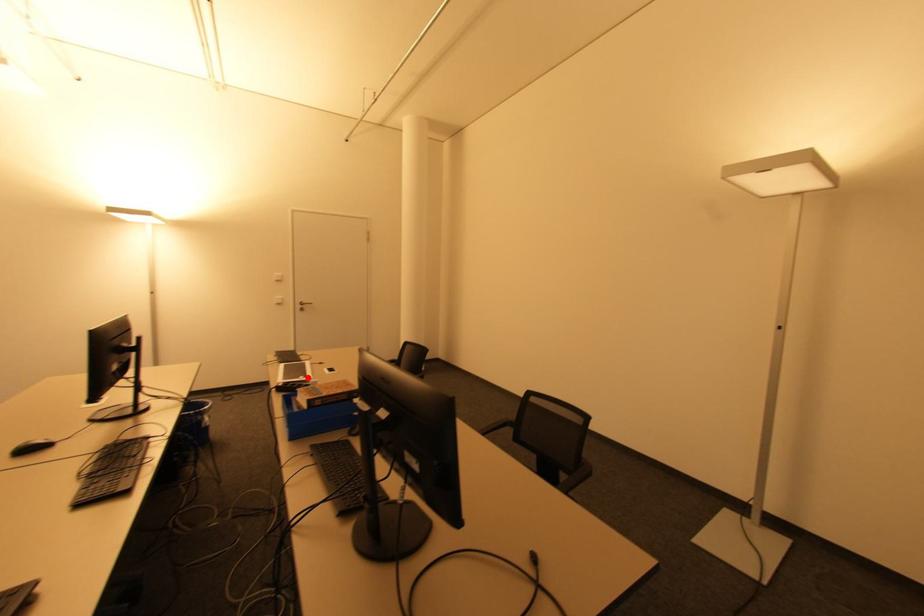
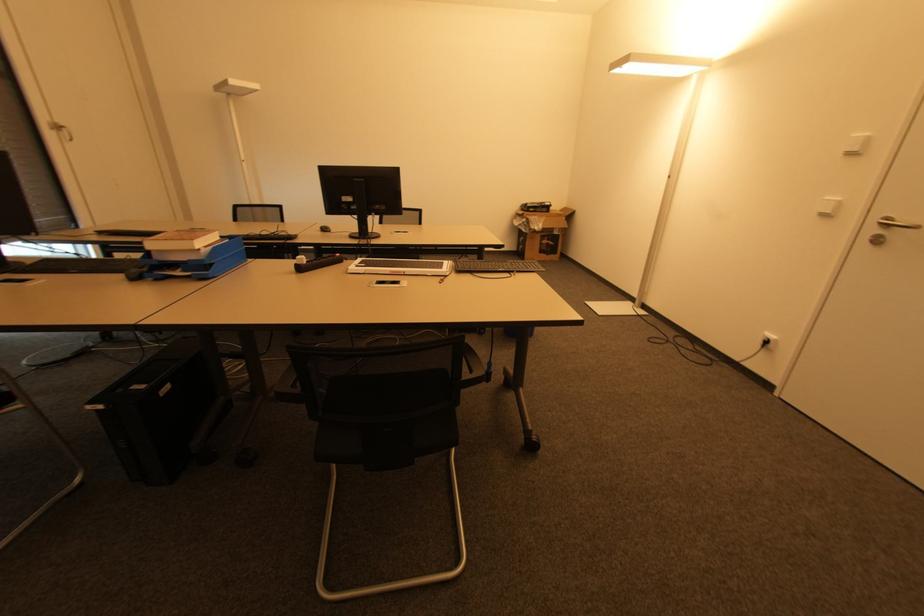
Locate, in the second image, the point that corresponds to the highlighted location in the first image.

(359, 267)